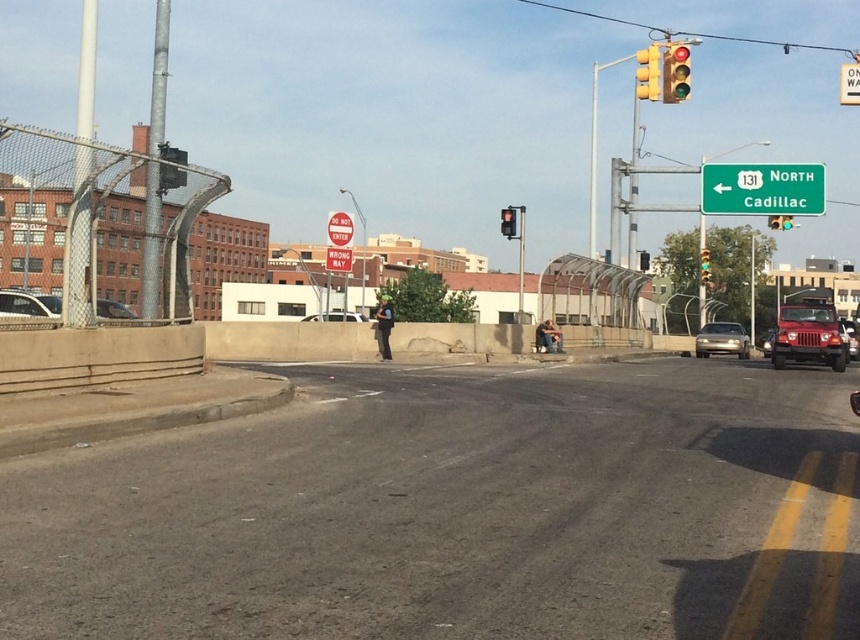
Does red glass traffic light at upper right have a greater width compared to metallic yellow traffic light at upper right?

In fact, red glass traffic light at upper right might be narrower than metallic yellow traffic light at upper right.

Who is positioned more to the left, red glass traffic light at upper right or metallic yellow traffic light at upper right?

From the viewer's perspective, red glass traffic light at upper right appears more on the left side.

Is point (688, 77) less distant than point (779, 221)?

Yes, point (688, 77) is closer to viewer.

Locate an element on the screen. This screenshot has height=640, width=860. red glass traffic light at upper right is located at coordinates (x=674, y=72).

Is point (473, 417) positioned behind point (732, 344)?

That is False.

Is asphalt at center above satin silver sedan at center?

No.

You are a GUI agent. You are given a task and a screenshot of the screen. Output one action in this format:
    pyautogui.click(x=<x>, y=<y>)
    Task: Click on the asphalt at center
    The height and width of the screenshot is (640, 860).
    Given the screenshot: What is the action you would take?
    pyautogui.click(x=458, y=512)

I want to click on asphalt at center, so click(x=458, y=512).

Between green metallic sign at upper right and satin silver sedan at center, which one appears on the right side from the viewer's perspective?

From the viewer's perspective, satin silver sedan at center appears more on the right side.

Which is behind, point (820, 180) or point (716, 333)?

Point (716, 333)

What do you see at coordinates (762, 189) in the screenshot? I see `green metallic sign at upper right` at bounding box center [762, 189].

Locate an element on the screen. The width and height of the screenshot is (860, 640). green metallic sign at upper right is located at coordinates (762, 189).